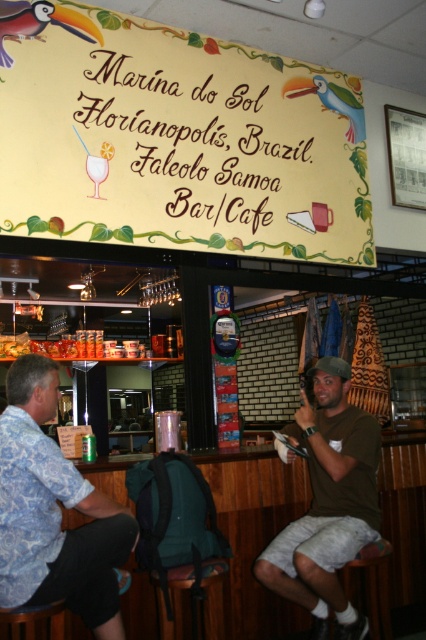
Question: Based on their relative distances, which object is farther from the polished wood parrot at upper left?

Choices:
 (A) yellow painted wood sign at upper center
 (B) green cotton t-shirt at center
 (C) dark brown leather bar stool at lower center

Answer: (C)

Question: Among these points, which one is farthest from the camera?

Choices:
 (A) (154, 576)
 (B) (374, 593)
 (C) (23, 4)

Answer: (C)

Question: Can you confirm if dark brown leather bar stool at lower right is bigger than wooden bar stool at lower left?

Choices:
 (A) yes
 (B) no

Answer: (A)

Question: Which point is closer to the camera?

Choices:
 (A) (317, 540)
 (B) (77, 529)
 (C) (374, 570)

Answer: (B)

Question: Does blue floral shirt at left appear over green cotton t-shirt at center?

Choices:
 (A) no
 (B) yes

Answer: (B)

Question: Does green cotton t-shirt at center appear on the right side of dark brown leather bar stool at lower center?

Choices:
 (A) no
 (B) yes

Answer: (B)